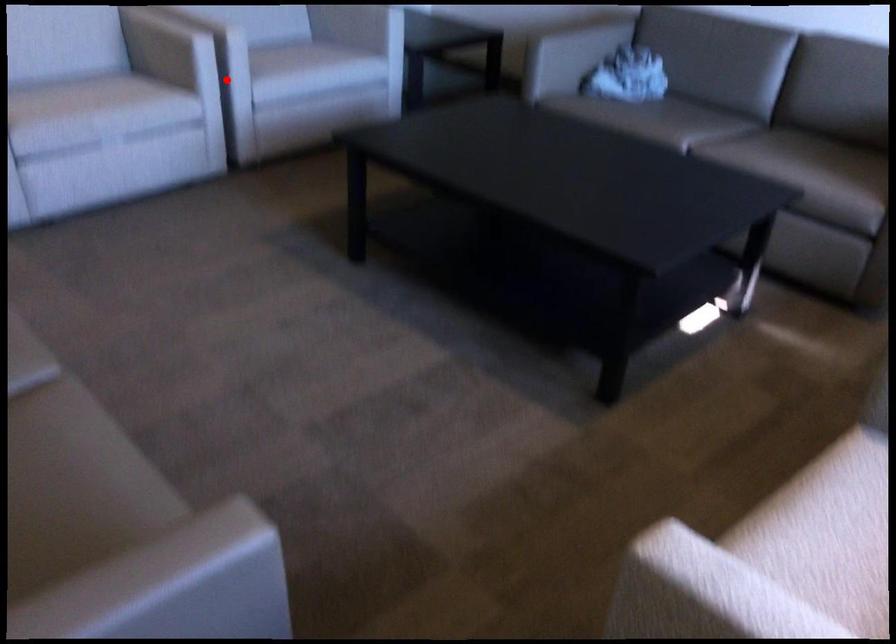
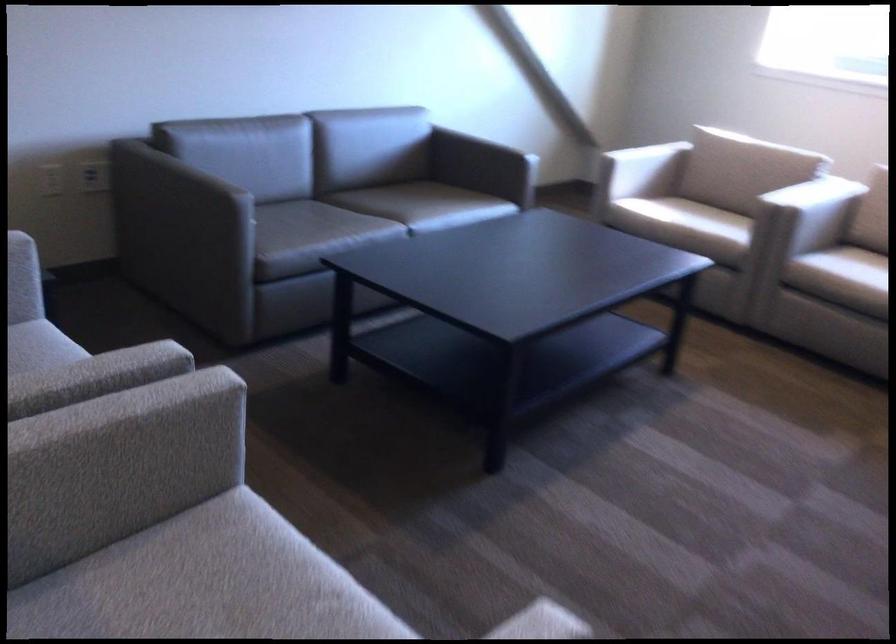
Question: I am providing you with two images of the same scene from different viewpoints. A red point is marked on the first image. Can you still see the location of the red point in image 2?

Choices:
 (A) Yes
 (B) No

Answer: (B)